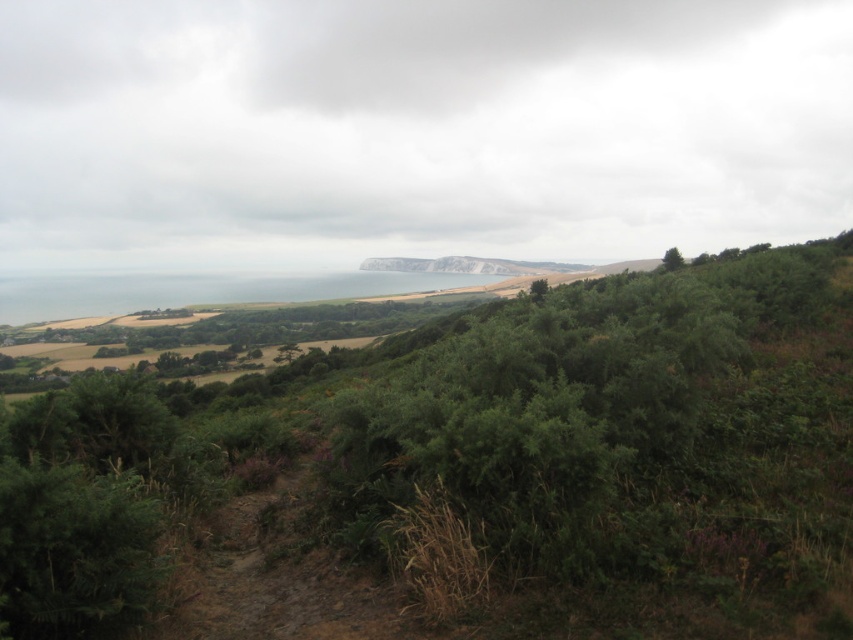
Who is positioned more to the right, green leafy tree at upper right or green leafy tree at center?

Positioned to the right is green leafy tree at upper right.

Does green leafy tree at upper right have a lesser width compared to green leafy tree at center?

Yes.

Where is `green leafy tree at upper right`? The width and height of the screenshot is (853, 640). green leafy tree at upper right is located at coordinates (672, 259).